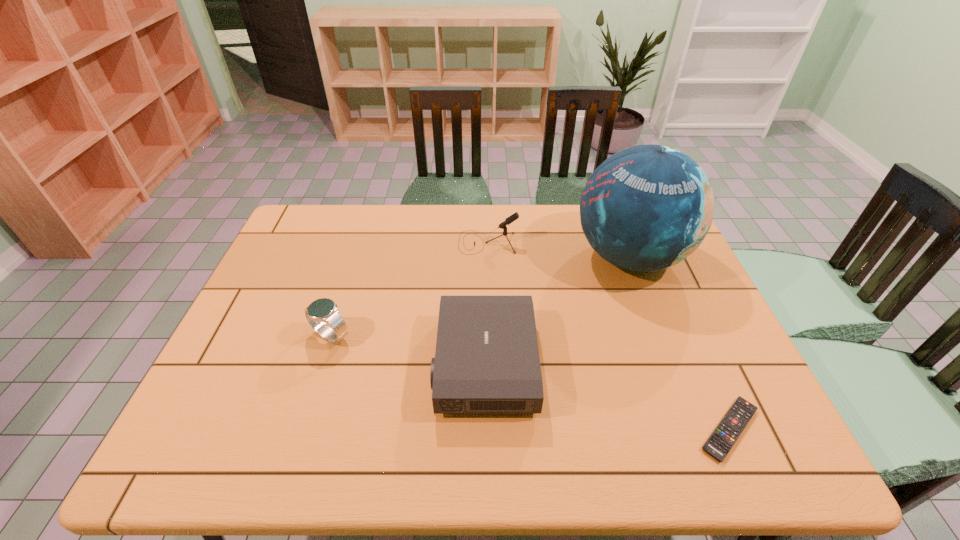
Image resolution: width=960 pixels, height=540 pixels. I want to click on vacant region located 0.270m on the front-facing side of the projector, so click(x=327, y=363).

This screenshot has width=960, height=540. I want to click on vacant region located 0.150m on the front-facing side of the projector, so click(375, 363).

At what (x,y) coordinates should I click in order to perform the action: click on free space located 0.050m on the front-facing side of the projector. Please return your answer as a coordinate pair (x, y). Looking at the image, I should click on (416, 363).

Locate an element on the screen. This screenshot has width=960, height=540. free region located on the back of the remote control is located at coordinates (690, 341).

Where is `globe positioned at the far edge`? The height and width of the screenshot is (540, 960). globe positioned at the far edge is located at coordinates (648, 207).

In order to click on microphone at the far edge in this screenshot , I will do `click(513, 217)`.

I want to click on object that is at the near edge, so click(x=720, y=442).

At what (x,y) coordinates should I click in order to perform the action: click on globe located in the right edge section of the desktop. Please return your answer as a coordinate pair (x, y). This screenshot has width=960, height=540. Looking at the image, I should click on (648, 207).

Where is `remote control that is at the right edge`? The width and height of the screenshot is (960, 540). remote control that is at the right edge is located at coordinates [x=720, y=442].

Locate an element on the screen. object that is at the far right corner is located at coordinates (648, 207).